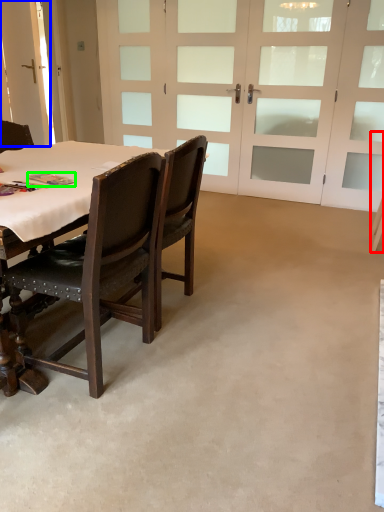
Question: Considering the real-world distances, which object is farthest from chair (highlighted by a red box)? barn door (highlighted by a blue box) or book (highlighted by a green box)?

Choices:
 (A) barn door
 (B) book

Answer: (A)